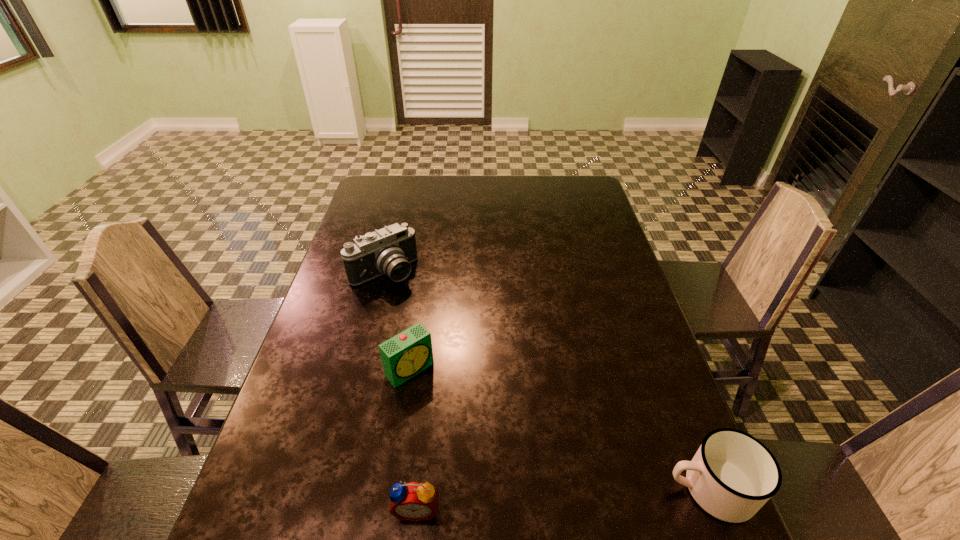
This screenshot has width=960, height=540. Identify the location of free space at the near edge. (513, 512).

You are a GUI agent. You are given a task and a screenshot of the screen. Output one action in this format:
    pyautogui.click(x=<x>, y=<y>)
    Task: Click on the free spot at the left edge of the desktop
    The height and width of the screenshot is (540, 960).
    Given the screenshot: What is the action you would take?
    pyautogui.click(x=348, y=302)

You are a GUI agent. You are given a task and a screenshot of the screen. Output one action in this format:
    pyautogui.click(x=<x>, y=<y>)
    Task: Click on the free space at the right edge of the desktop
    The height and width of the screenshot is (540, 960).
    Given the screenshot: What is the action you would take?
    pyautogui.click(x=609, y=315)

Identify the location of vacant area at the far left corner. [368, 190].

The height and width of the screenshot is (540, 960). In the image, there is a desktop. Find the location of `free region at the near right corner`. free region at the near right corner is located at coordinates (700, 511).

Locate an element on the screen. This screenshot has width=960, height=540. free space between the nearer alarm clock and the farthest object is located at coordinates (400, 390).

Find the location of a particular element. vacant area between the camera and the nearer alarm clock is located at coordinates (400, 390).

You are a GUI agent. You are given a task and a screenshot of the screen. Output one action in this format:
    pyautogui.click(x=<x>, y=<y>)
    Task: Click on the free space between the mug and the third nearest object
    The image size is (960, 540).
    Given the screenshot: What is the action you would take?
    pyautogui.click(x=560, y=429)

Identify the location of blank region between the nearer alarm clock and the rightmost object. (564, 498).

This screenshot has width=960, height=540. I want to click on empty space that is in between the rightmost object and the camera, so click(546, 380).